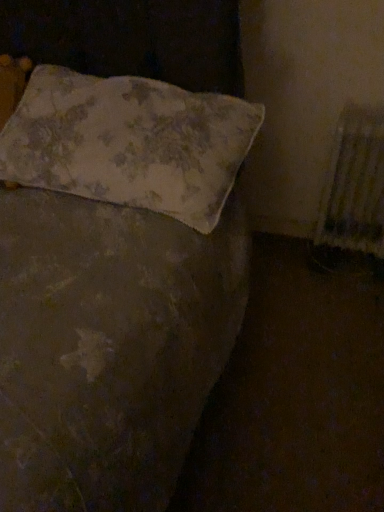
Measure the distance between point (327, 207) and camera.

Point (327, 207) and camera are 5.94 feet apart from each other.

The width and height of the screenshot is (384, 512). Identify the location of white textured radiator at right. (355, 184).

The image size is (384, 512). What do you see at coordinates (355, 184) in the screenshot?
I see `white textured radiator at right` at bounding box center [355, 184].

Identify the location of floral fabric pillow at upper left. (129, 143).

Describe the element at coordinates (129, 143) in the screenshot. This screenshot has width=384, height=512. I see `floral fabric pillow at upper left` at that location.

Find the location of a particular element. This screenshot has height=512, width=384. white textured radiator at right is located at coordinates pyautogui.click(x=355, y=184).

Between floral fabric pillow at upper left and white textured radiator at right, which one appears on the right side from the viewer's perspective?

white textured radiator at right is more to the right.

Is the depth of floral fabric pillow at upper left less than that of white textured radiator at right?

Yes, it is in front of white textured radiator at right.

Does point (175, 103) lie behind point (366, 214)?

No, it is not.

From the image's perspective, which one is positioned higher, floral fabric pillow at upper left or white textured radiator at right?

floral fabric pillow at upper left.

From a real-world perspective, is floral fabric pillow at upper left physically located above or below white textured radiator at right?

floral fabric pillow at upper left is above white textured radiator at right.

Does floral fabric pillow at upper left have a greater width compared to white textured radiator at right?

Correct, the width of floral fabric pillow at upper left exceeds that of white textured radiator at right.

Considering the sizes of objects floral fabric pillow at upper left and white textured radiator at right in the image provided, who is shorter, floral fabric pillow at upper left or white textured radiator at right?

With less height is floral fabric pillow at upper left.

Does floral fabric pillow at upper left have a smaller size compared to white textured radiator at right?

No, floral fabric pillow at upper left is not smaller than white textured radiator at right.

Would you say floral fabric pillow at upper left contains white textured radiator at right?

No, white textured radiator at right is not inside floral fabric pillow at upper left.

Is floral fabric pillow at upper left touching white textured radiator at right?

There is a gap between floral fabric pillow at upper left and white textured radiator at right.

Based on the photo, is floral fabric pillow at upper left turned away from white textured radiator at right?

That's not correct — floral fabric pillow at upper left is not looking away from white textured radiator at right.

Identify the location of pillow lying on the left of white textured radiator at right. Image resolution: width=384 pixels, height=512 pixels. (129, 143).

Is white textured radiator at right to the left of floral fabric pillow at upper left from the viewer's perspective?

No, white textured radiator at right is not to the left of floral fabric pillow at upper left.

Does white textured radiator at right lie in front of floral fabric pillow at upper left?

That is False.

Is point (354, 114) farther from camera compared to point (121, 166)?

Yes, point (354, 114) is behind point (121, 166).

From the picture: From the image's perspective, is white textured radiator at right on floral fabric pillow at upper left?

No, from the image's perspective, white textured radiator at right is not over floral fabric pillow at upper left.

From a real-world perspective, which object stands above the other?

From a 3D spatial view, floral fabric pillow at upper left is above.

Which object is thinner, white textured radiator at right or floral fabric pillow at upper left?

With smaller width is white textured radiator at right.

Who is taller, white textured radiator at right or floral fabric pillow at upper left?

white textured radiator at right.

Is white textured radiator at right bigger or smaller than floral fabric pillow at upper left?

Considering their sizes, white textured radiator at right takes up less space than floral fabric pillow at upper left.

Could floral fabric pillow at upper left be considered to be inside white textured radiator at right?

No, floral fabric pillow at upper left is not a part of white textured radiator at right.

Is white textured radiator at right next to floral fabric pillow at upper left and touching it?

No, white textured radiator at right is not with floral fabric pillow at upper left.

Is white textured radiator at right oriented towards floral fabric pillow at upper left?

No, white textured radiator at right is not facing towards floral fabric pillow at upper left.

This screenshot has width=384, height=512. I want to click on radiator below the floral fabric pillow at upper left (from the image's perspective), so [x=355, y=184].

Locate an element on the screen. The height and width of the screenshot is (512, 384). pillow above the white textured radiator at right (from a real-world perspective) is located at coordinates (129, 143).

At what (x,y) coordinates should I click in order to perform the action: click on radiator to the right of floral fabric pillow at upper left. Please return your answer as a coordinate pair (x, y). Looking at the image, I should click on (355, 184).